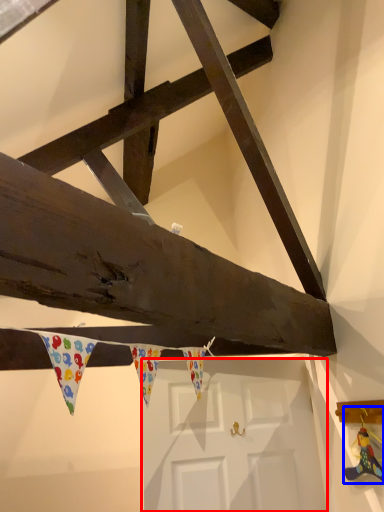
Question: Among these objects, which one is farthest to the camera, door (highlighted by a red box) or toy (highlighted by a blue box)?

Choices:
 (A) door
 (B) toy

Answer: (A)